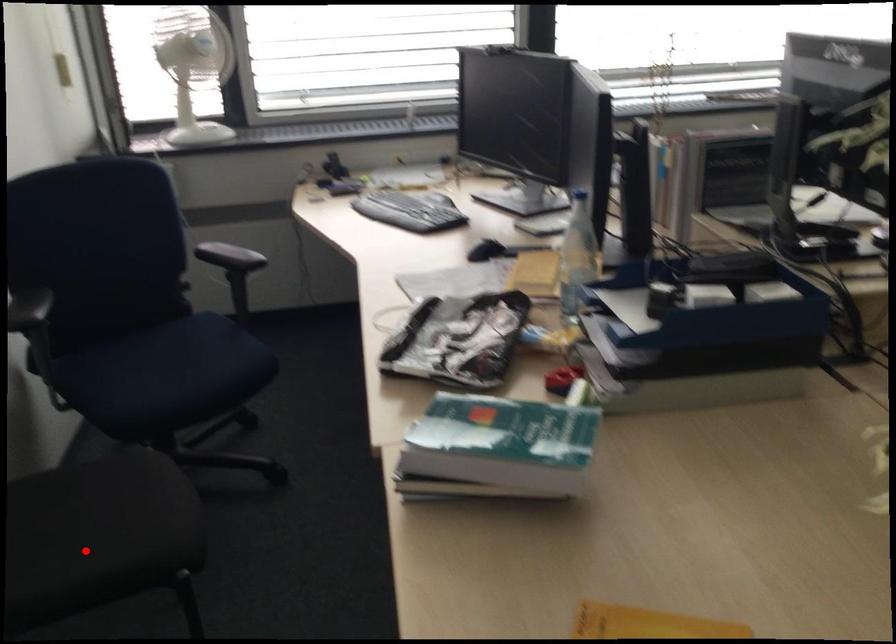
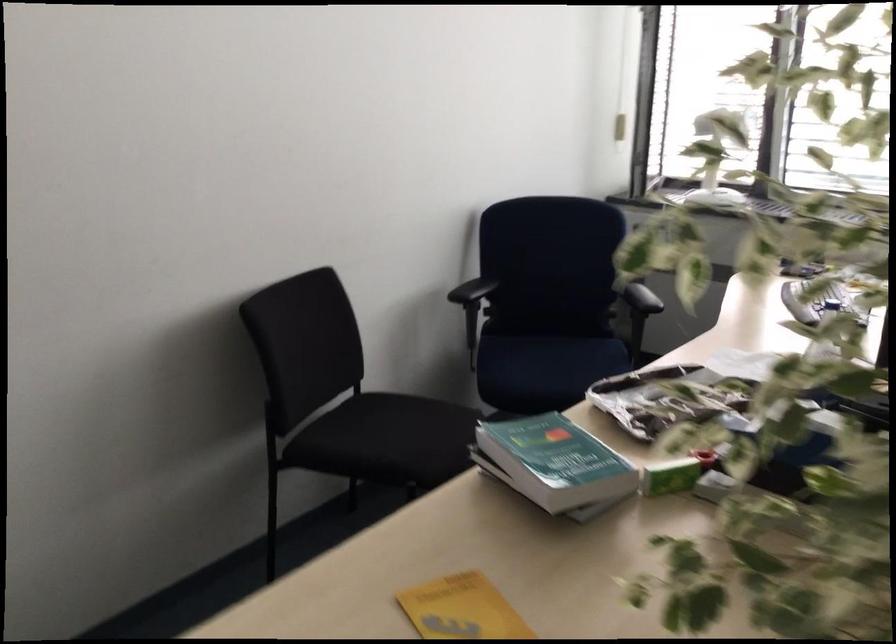
Question: I am providing you with two images of the same scene from different viewpoints. A red point is marked on the first image. Can you still see the location of the red point in image 2?

Choices:
 (A) Yes
 (B) No

Answer: (A)